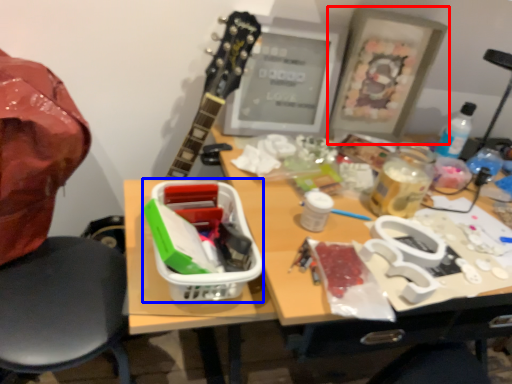
Question: Which object appears closest to the camera in this image, picture frame (highlighted by a red box) or lunch box (highlighted by a blue box)?

Choices:
 (A) picture frame
 (B) lunch box

Answer: (B)